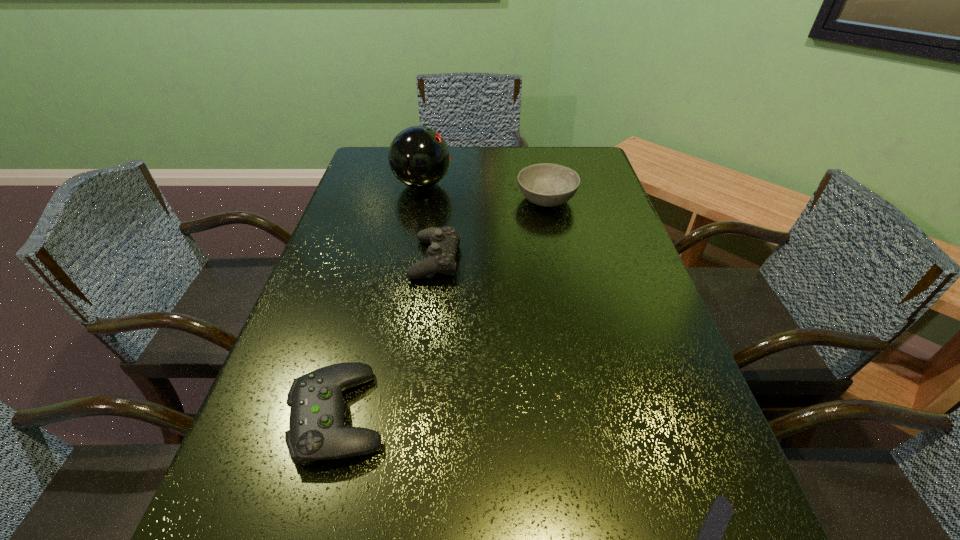
Where is `object located at the far edge`? The width and height of the screenshot is (960, 540). object located at the far edge is located at coordinates (419, 157).

Identify the location of bowling ball positioned at the left edge. This screenshot has width=960, height=540. (419, 157).

Identify the location of control that is at the left edge. Image resolution: width=960 pixels, height=540 pixels. (316, 432).

Where is `object positioned at the right edge`? object positioned at the right edge is located at coordinates (545, 184).

Where is `object at the far left corner`? object at the far left corner is located at coordinates (419, 157).

The image size is (960, 540). Find the location of `blank area at the far edge`. blank area at the far edge is located at coordinates (472, 171).

Locate an element on the screen. vacant region at the left edge of the desktop is located at coordinates (379, 264).

In the image, there is a desktop. Where is `free region at the right edge`? The image size is (960, 540). free region at the right edge is located at coordinates pos(662,386).

In the image, there is a desktop. Where is `free space at the far left corner`? Image resolution: width=960 pixels, height=540 pixels. free space at the far left corner is located at coordinates (355, 183).

Locate an element on the screen. Image resolution: width=960 pixels, height=540 pixels. vacant point located between the bowling ball and the taller control is located at coordinates (429, 222).